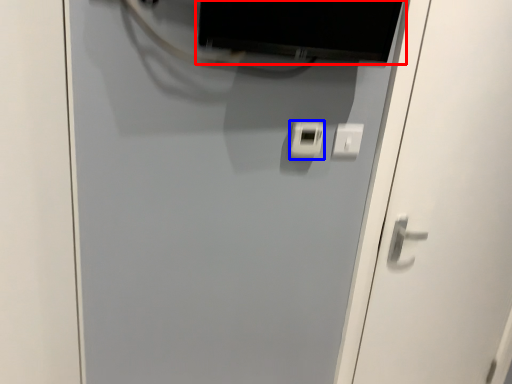
Question: Among these objects, which one is nearest to the camera, computer monitor (highlighted by a red box) or light switch (highlighted by a blue box)?

Choices:
 (A) computer monitor
 (B) light switch

Answer: (A)